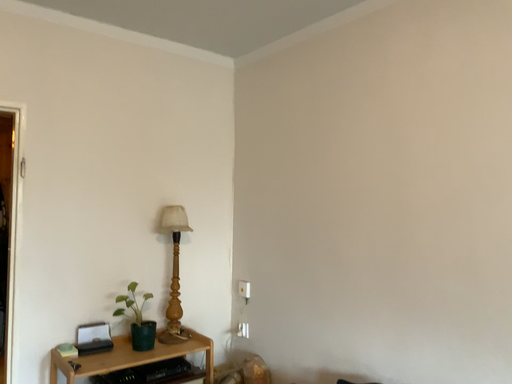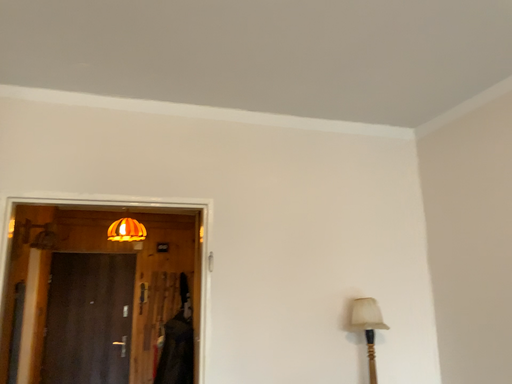
Question: Which way did the camera rotate in the video?

Choices:
 (A) rotated right
 (B) rotated left

Answer: (B)